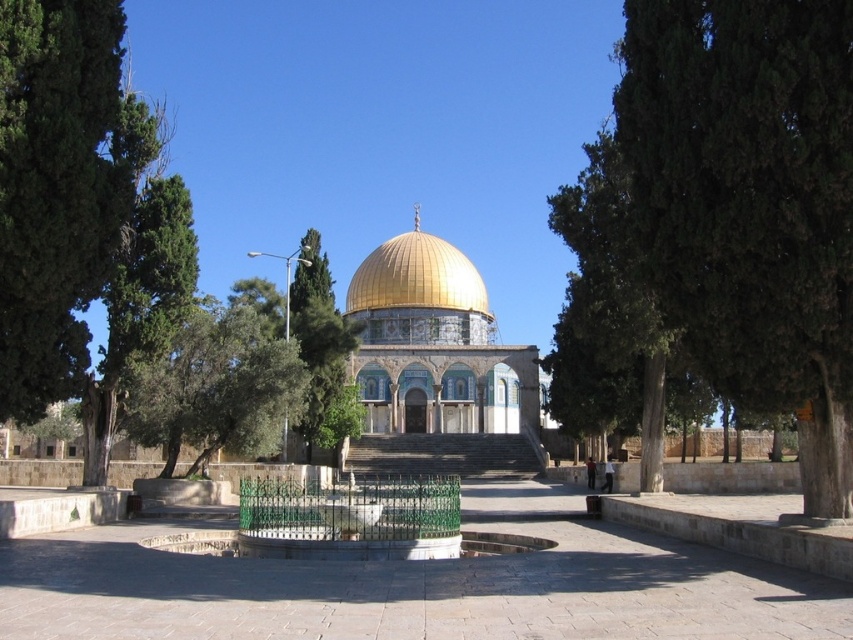
You are a landscape architect planning to add more trees around the Dome of the Rock. You observe the green textured tree at right and the green leafy tree at center. Which tree has a wider canopy? Please consider their widths as described.

The green textured tree at right has a wider canopy than the green leafy tree at center because its width surpasses the latter according to the description.

You are a tourist visiting the Dome of the Rock. You want to take a photo that includes both the green leafy tree at center and the gray stone stairs at center. Which object should you focus on first to ensure both are in the frame?

The green leafy tree at center is bigger than the gray stone stairs at center, so you should focus on the green leafy tree at center first to ensure both are in the frame.

You are a tourist standing at the base of the gray stone stairs at center, looking towards the green leafy tree at center. Which object is higher from the ground?

The green leafy tree at center is taller than the gray stone stairs at center, so the green leafy tree at center is higher from the ground.